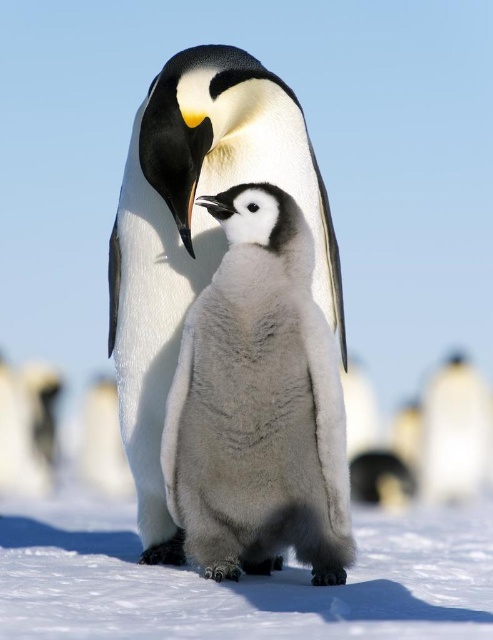
You are a photographer trying to capture the penguin chick. You notice the white fluffy snow at lower center and the white fluffy penguin at center. Which one is closer to the ground?

The white fluffy snow at lower center is below the white fluffy penguin at center, so the snow is closer to the ground.

You are observing two points in the image of the penguins. Which point, point (33, 550) or point (469, 372), is closer to you?

Point (33, 550) is closer to the viewer than point (469, 372).